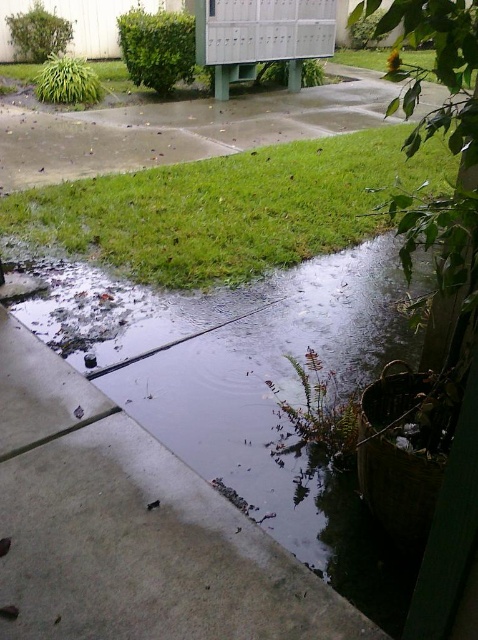
Question: Among these objects, which one is nearest to the camera?

Choices:
 (A) gray concrete pavement at lower center
 (B) green grass at lower left

Answer: (A)

Question: Can you confirm if gray concrete pavement at lower center is wider than green grass at lower left?

Choices:
 (A) yes
 (B) no

Answer: (B)

Question: Can you confirm if gray concrete pavement at lower center is bigger than green grass at lower left?

Choices:
 (A) no
 (B) yes

Answer: (A)

Question: Among these objects, which one is nearest to the camera?

Choices:
 (A) gray concrete pavement at lower center
 (B) green grass at lower left

Answer: (A)

Question: Where is gray concrete pavement at lower center located in relation to green grass at lower left in the image?

Choices:
 (A) below
 (B) above

Answer: (A)